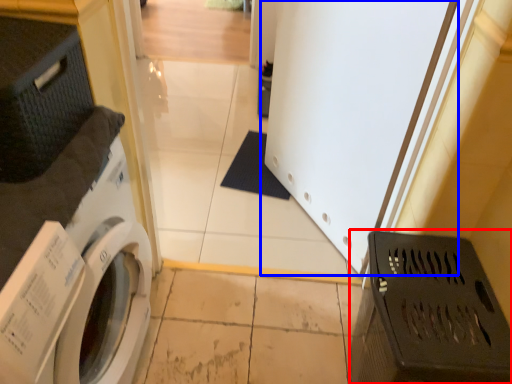
Question: Among these objects, which one is farthest to the camera, laundry basket (highlighted by a red box) or screen door (highlighted by a blue box)?

Choices:
 (A) laundry basket
 (B) screen door

Answer: (B)